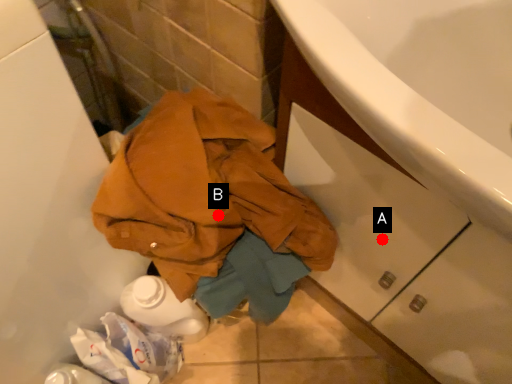
Question: Two points are circled on the image, labeled by A and B beside each circle. Among these points, which one is nearest to the camera?

Choices:
 (A) A is closer
 (B) B is closer

Answer: (B)